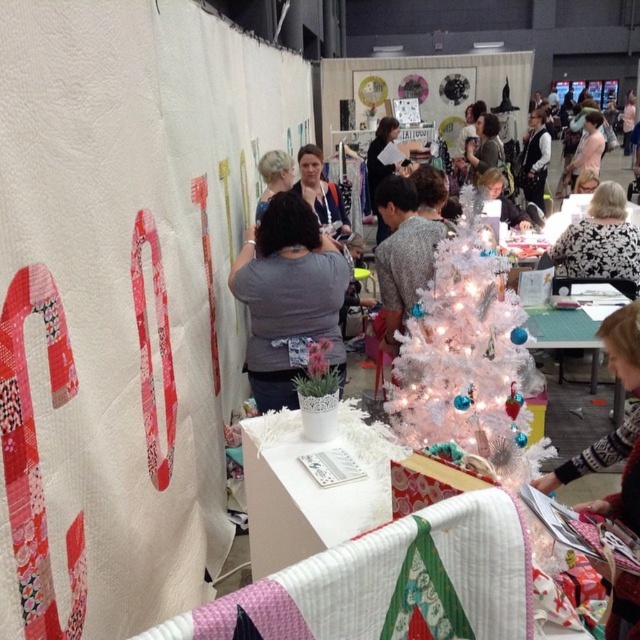
Question: Which point is farther to the camera?

Choices:
 (A) (621, 202)
 (B) (400, 252)
 (C) (259, 225)
 (D) (262, 195)

Answer: (D)

Question: Considering the real-world distances, which object is farthest from the black and white sweater at center?

Choices:
 (A) quilted fabric at center
 (B) white glittery christmas tree at center

Answer: (A)

Question: Which is farther from the white glittery christmas tree at center?

Choices:
 (A) quilted fabric at center
 (B) blonde hair at center
 (C) black and white sweater at center

Answer: (C)

Question: Does quilted fabric at center appear on the left side of black and white sweater at center?

Choices:
 (A) yes
 (B) no

Answer: (A)

Question: Does white glittery christmas tree at center have a greater width compared to gray fabric shirt at center?

Choices:
 (A) yes
 (B) no

Answer: (A)

Question: In this image, where is white glittery christmas tree at center located relative to black and white sweater at center?

Choices:
 (A) right
 (B) left

Answer: (B)